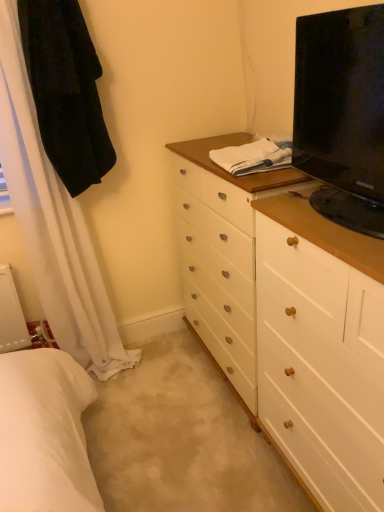
Question: Is black fabric robe at upper left surrounding black glossy tv at upper right?

Choices:
 (A) no
 (B) yes

Answer: (A)

Question: Does black fabric robe at upper left come behind black glossy tv at upper right?

Choices:
 (A) no
 (B) yes

Answer: (B)

Question: From the image's perspective, is black fabric robe at upper left located beneath black glossy tv at upper right?

Choices:
 (A) yes
 (B) no

Answer: (B)

Question: Is black fabric robe at upper left at the right side of black glossy tv at upper right?

Choices:
 (A) yes
 (B) no

Answer: (B)

Question: Is black fabric robe at upper left taller than black glossy tv at upper right?

Choices:
 (A) yes
 (B) no

Answer: (A)

Question: Is black fabric robe at upper left positioned in front of black glossy tv at upper right?

Choices:
 (A) yes
 (B) no

Answer: (B)

Question: Does black glossy tv at upper right come behind black fabric robe at upper left?

Choices:
 (A) no
 (B) yes

Answer: (A)

Question: Is black glossy tv at upper right with black fabric robe at upper left?

Choices:
 (A) no
 (B) yes

Answer: (A)

Question: Is black glossy tv at upper right in front of black fabric robe at upper left?

Choices:
 (A) no
 (B) yes

Answer: (B)

Question: Are black glossy tv at upper right and black fabric robe at upper left located far from each other?

Choices:
 (A) no
 (B) yes

Answer: (A)

Question: Is black glossy tv at upper right at the right side of black fabric robe at upper left?

Choices:
 (A) no
 (B) yes

Answer: (B)

Question: From a real-world perspective, is black glossy tv at upper right below black fabric robe at upper left?

Choices:
 (A) no
 (B) yes

Answer: (B)

Question: Is point (66, 175) closer or farther from the camera than point (364, 37)?

Choices:
 (A) farther
 (B) closer

Answer: (A)